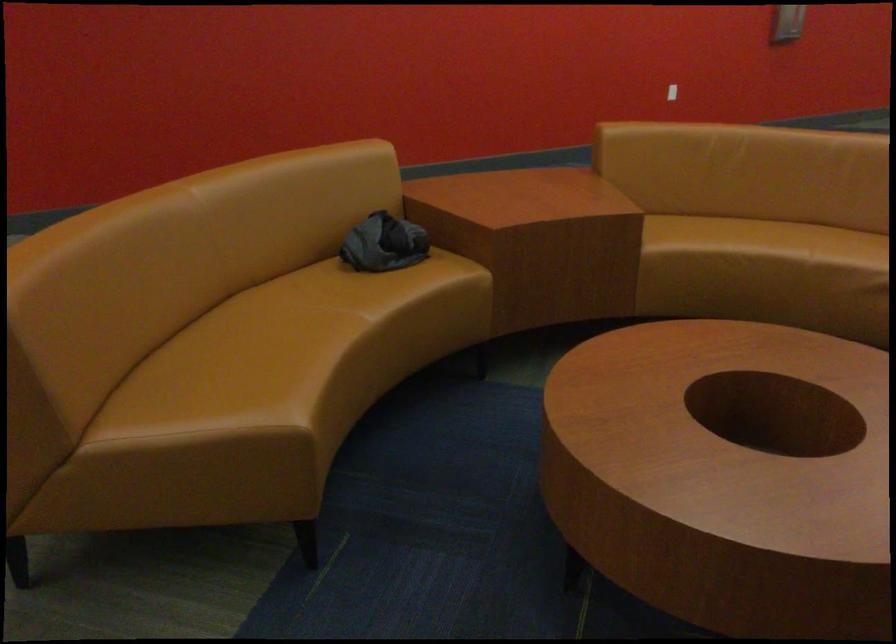
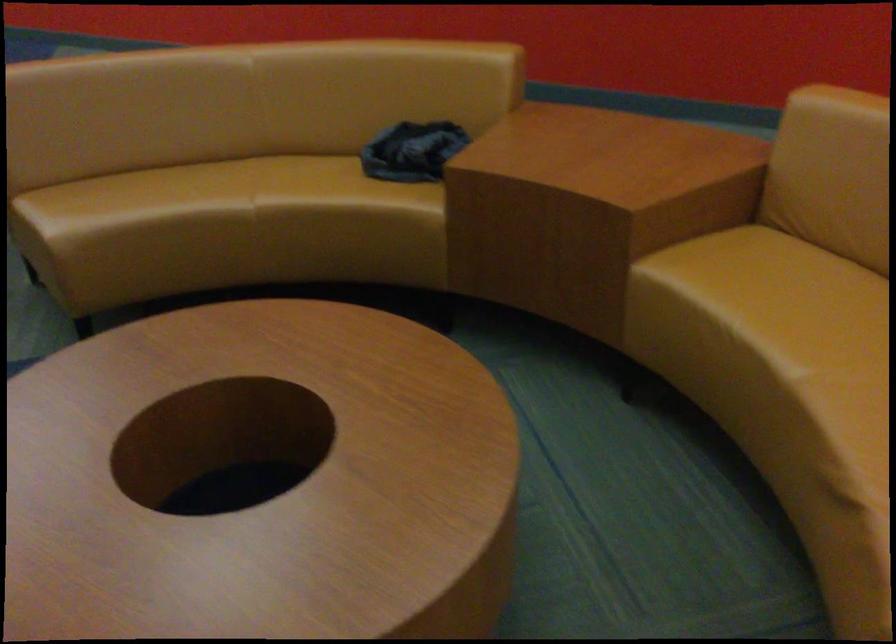
Find the pixel in the second image that matches [754,234] in the first image.

(814, 308)